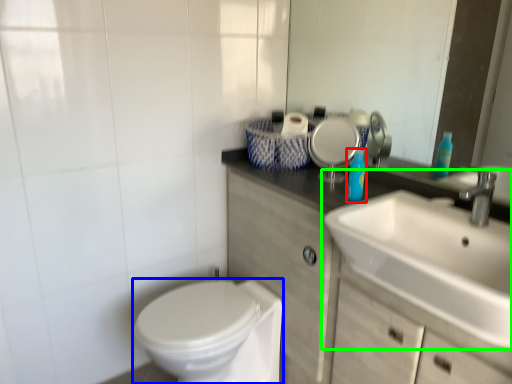
Question: Which object is the farthest from toiletry (highlighted by a red box)? Choose among these: bidet (highlighted by a blue box) or sink (highlighted by a green box).

Choices:
 (A) bidet
 (B) sink

Answer: (A)